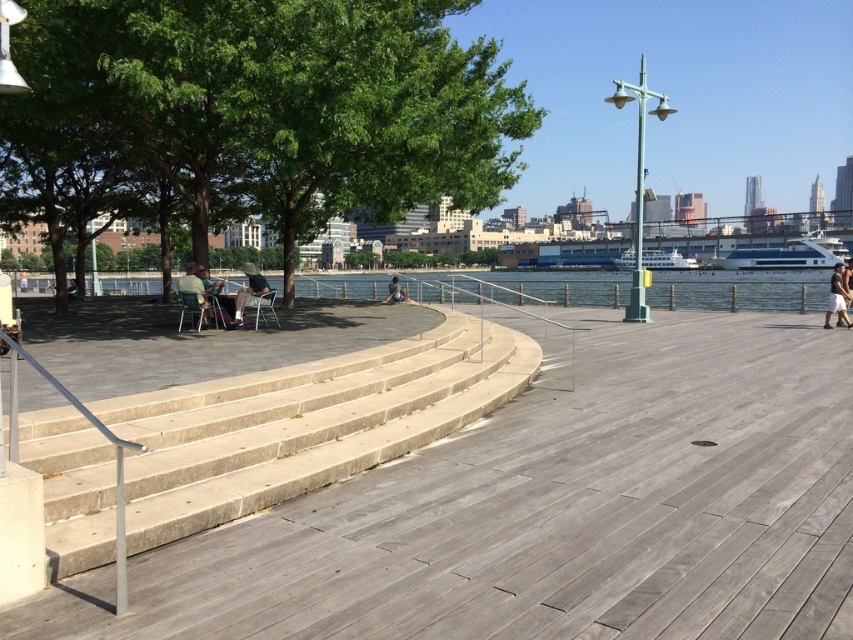
Who is lower down, beige concrete stairs at left or matte black chair at left?

beige concrete stairs at left is lower down.

Is beige concrete stairs at left to the right of matte black chair at left from the viewer's perspective?

Yes, beige concrete stairs at left is to the right of matte black chair at left.

Does point (175, 419) lie behind point (222, 308)?

No, it is not.

Image resolution: width=853 pixels, height=640 pixels. In order to click on beige concrete stairs at left in this screenshot , I will do `click(305, 422)`.

Who is taller, beige concrete stairs at left or matte black umbrella at center?

With more height is matte black umbrella at center.

This screenshot has width=853, height=640. I want to click on beige concrete stairs at left, so click(x=305, y=422).

The width and height of the screenshot is (853, 640). What are the coordinates of `beige concrete stairs at left` in the screenshot? It's located at (305, 422).

Does matte green chair at left have a greater width compared to matte black umbrella at center?

Correct, the width of matte green chair at left exceeds that of matte black umbrella at center.

Is matte green chair at left positioned behind matte black umbrella at center?

That is False.

Does point (213, 310) lie in front of point (264, 284)?

Yes, point (213, 310) is closer to viewer.

What are the coordinates of `matte green chair at left` in the screenshot? It's located at (198, 288).